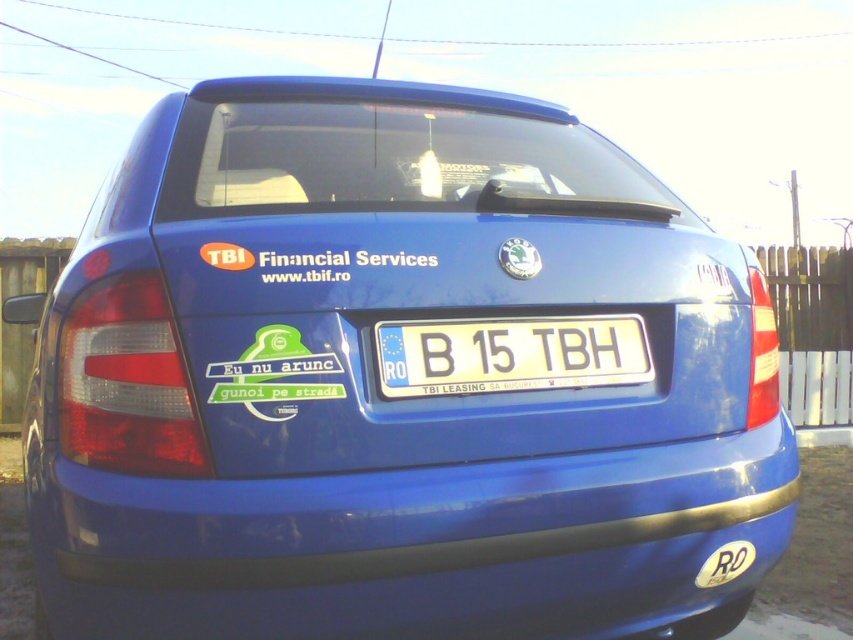
You are standing in front of a blue Skoda car and want to place a small sticker between the glossy plastic bumper at lower center and the white plastic license plate at center. Based on their positions, which object is nearer to you where you can easily reach to place the sticker?

The glossy plastic bumper at lower center is closer to the viewer than the white plastic license plate at center, so you can easily place the sticker on the glossy plastic bumper at lower center.

You are a delivery person trying to attach a package to the back of the blue Skoda car. The package is 1.2 meters wide. The glossy plastic bumper at lower center and the white plastic license plate at center are both in your way. Which object is wider, allowing you to place the package on the bumper without covering the license plate?

The glossy plastic bumper at lower center is wider than the white plastic license plate at center, so placing the package on the bumper would avoid covering the license plate since it has more space.

You are a delivery driver who needs to attach a GPS tracker to your blue Skoda car. The GPS tracker requires a minimum of 10 inches of space to be securely mounted. Based on the image, can you attach the tracker between the glossy plastic bumper at lower center and the white plastic license plate at center?

The glossy plastic bumper at lower center and white plastic license plate at center are 9.48 inches apart from each other. Since the GPS tracker requires a minimum of 10 inches of space, the distance is insufficient. Therefore, you cannot securely mount the GPS tracker between them.